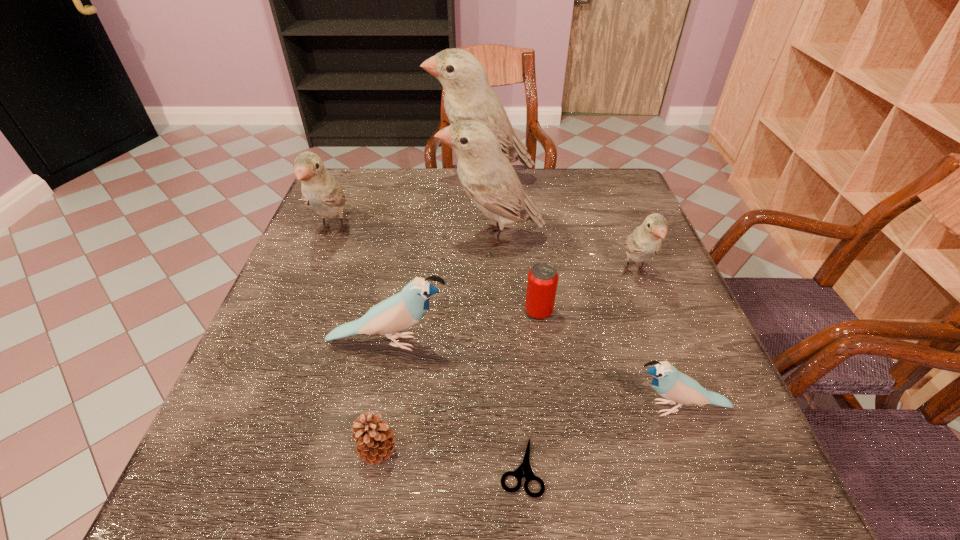
Locate an element on the screen. free space that satisfies the following two spatial constraints: 1. at the face of the biggest white bird; 2. at the face of the fourth shortest bird is located at coordinates (482, 233).

Where is `vacant space that satisfies the following two spatial constraints: 1. on the back side of the pinecone; 2. at the face of the second nearest bird`? The height and width of the screenshot is (540, 960). vacant space that satisfies the following two spatial constraints: 1. on the back side of the pinecone; 2. at the face of the second nearest bird is located at coordinates (397, 342).